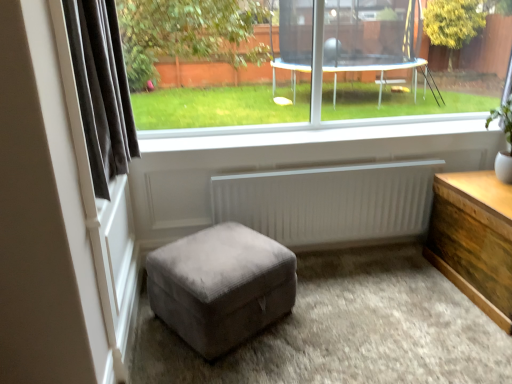
The width and height of the screenshot is (512, 384). In order to click on free spot to the right of suede ottoman at center in this screenshot , I will do `click(330, 323)`.